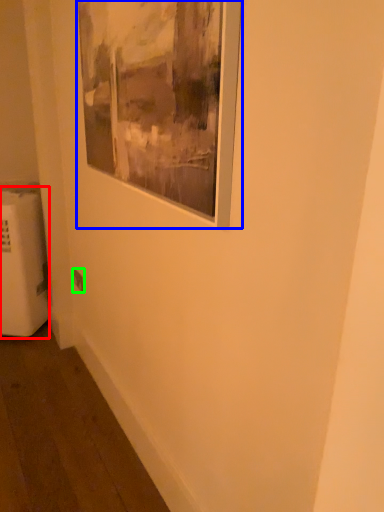
Question: Considering the real-world distances, which object is farthest from radiator (highlighted by a red box)? picture frame (highlighted by a blue box) or electric outlet (highlighted by a green box)?

Choices:
 (A) picture frame
 (B) electric outlet

Answer: (A)